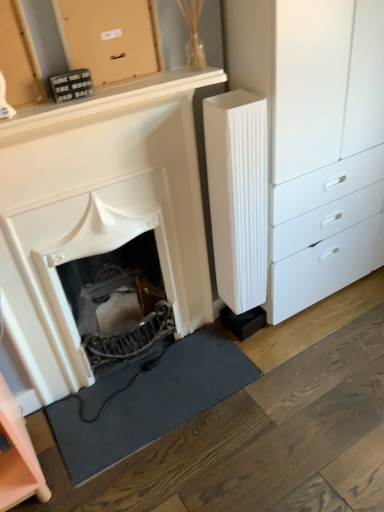
Question: Is wooden board at upper center, arranged as the first cabinetry when viewed from the top, wider or thinner than white matte fireplace at center?

Choices:
 (A) thin
 (B) wide

Answer: (A)

Question: Based on their sizes in the image, would you say wooden board at upper center, which is the 1th cabinetry in right-to-left order, is bigger or smaller than white matte fireplace at center?

Choices:
 (A) small
 (B) big

Answer: (A)

Question: Which object is the farthest from the white ribbed radiator at right?

Choices:
 (A) black rubber doormat at lower left
 (B) white matte chest of drawers at right
 (C) white matte fireplace at center
 (D) wooden board at upper center, which is counted as the second cabinetry, starting from the left
 (E) pink matte cabinet at lower left, arranged as the second cabinetry when viewed from the top

Answer: (E)

Question: Estimate the real-world distances between objects in this image. Which object is closer to the white matte fireplace at center?

Choices:
 (A) white ribbed radiator at right
 (B) pink matte cabinet at lower left, arranged as the second cabinetry when viewed from the top
 (C) black rubber doormat at lower left
 (D) wooden board at upper center, which is the 1th cabinetry in right-to-left order
 (E) white matte chest of drawers at right

Answer: (A)